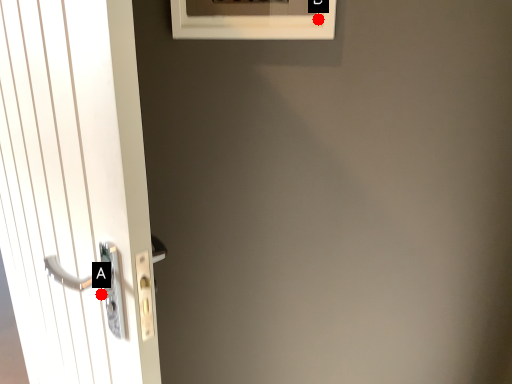
Question: Two points are circled on the image, labeled by A and B beside each circle. Which point is farther from the camera taking this photo?

Choices:
 (A) A is further
 (B) B is further

Answer: (B)